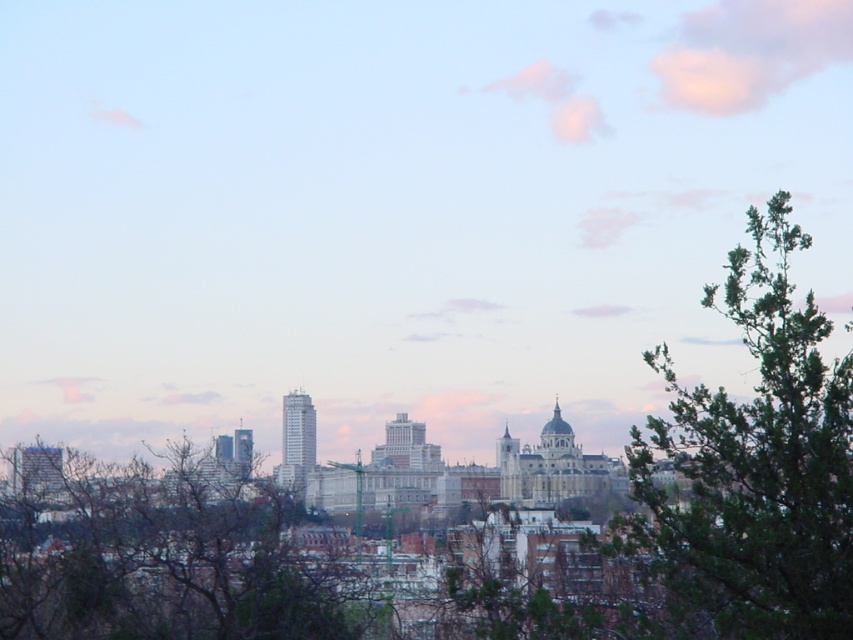
You are a city planner analyzing this urban scene. You need to determine which object occupies more space in the image for a report. Which one is bigger between the green leafy tree at right and the bare branches at center?

The green leafy tree at right has a larger size compared to the bare branches at center, so it occupies more space in the image.

You are a city planner analyzing this scene. You need to determine which tree has a narrower width for potential space planning. Which one is narrower between the green leafy tree at right and the bare branches at center?

The green leafy tree at right is narrower than the bare branches at center because its width is less than that of the bare branches at center.

You are a drone operator who needs to fly a drone from the green leafy tree at right to the bare branches at center. According to the image, what is the approximate distance you need to cover?

The green leafy tree at right is 361.48 feet away from the bare branches at center, so the approximate distance to cover is 361.48 feet.